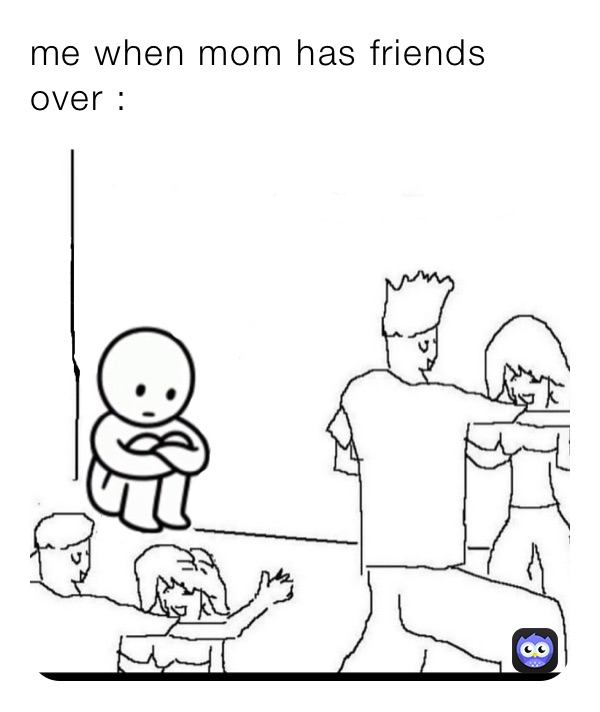
Image resolution: width=600 pixels, height=712 pixels. I want to click on little person sitting in left corner of room with knees drawn up and hands around knees, so click(108, 429).